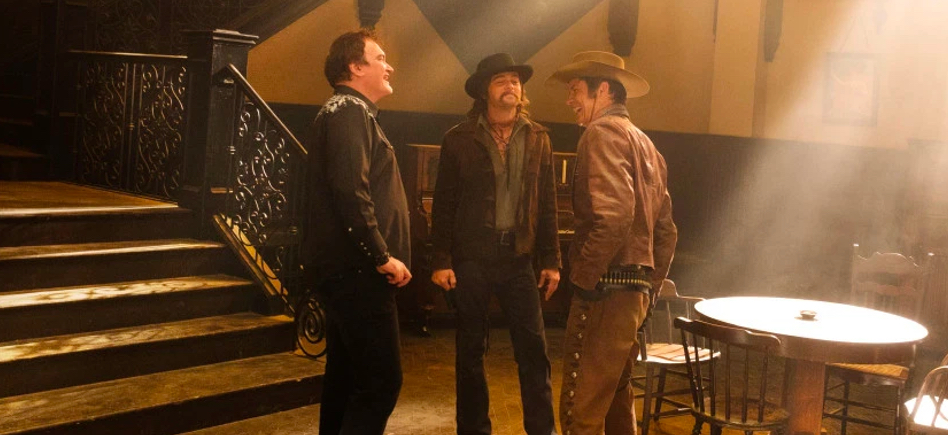
I want to click on wood stairs, so click(213, 370), click(190, 330), click(166, 298), click(137, 255), click(113, 220).